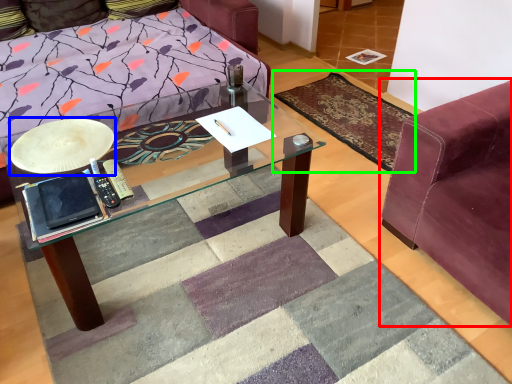
Question: Based on their relative distances, which object is nearer to studio couch (highlighted by a red box)? Choose from round table (highlighted by a blue box) and mat (highlighted by a green box).

Choices:
 (A) round table
 (B) mat

Answer: (B)